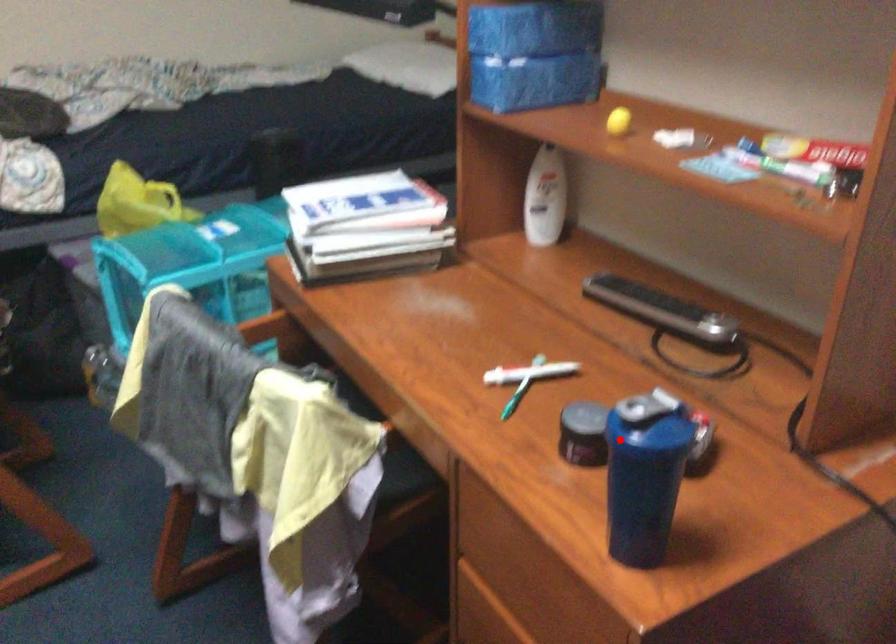
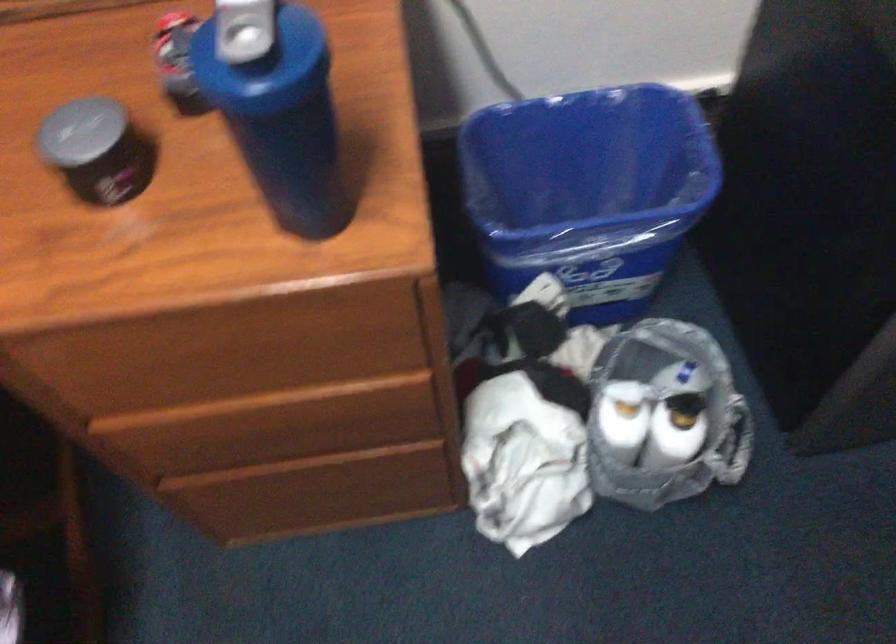
Question: I am providing you with two images of the same scene from different viewpoints. A red point is shown in image1. For the corresponding object point in image2, is it positioned nearer or farther from the camera?

Choices:
 (A) Nearer
 (B) Farther

Answer: (A)